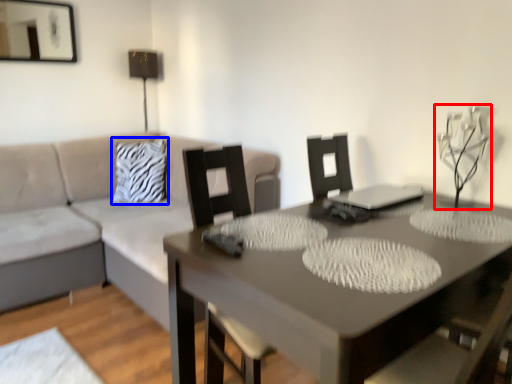
Question: Which object is further to the camera taking this photo, candle holder (highlighted by a red box) or pillow (highlighted by a blue box)?

Choices:
 (A) candle holder
 (B) pillow

Answer: (B)